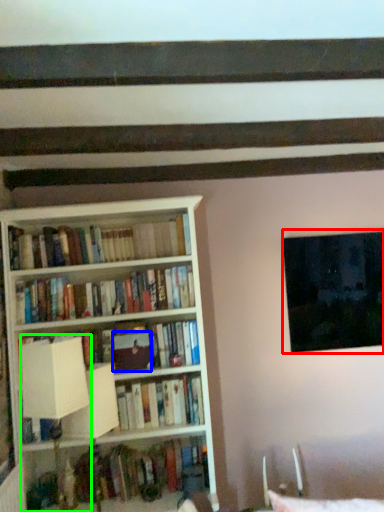
Question: Considering the real-world distances, which object is closest to window (highlighted by a red box)? paperback book (highlighted by a blue box) or table lamp (highlighted by a green box).

Choices:
 (A) paperback book
 (B) table lamp

Answer: (A)